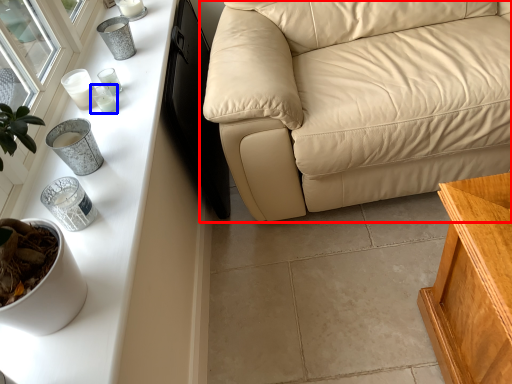
Question: Among these objects, which one is farthest to the camera, studio couch (highlighted by a red box) or candle holder (highlighted by a blue box)?

Choices:
 (A) studio couch
 (B) candle holder

Answer: (B)